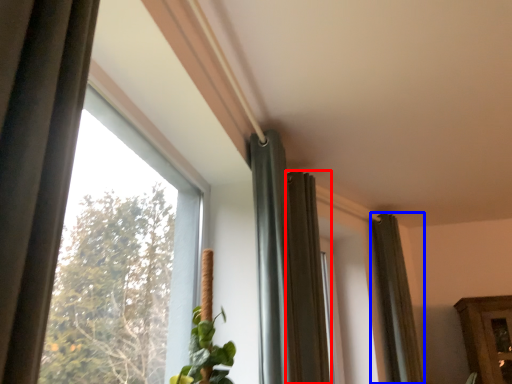
Question: Which point is further to the camera, curtain (highlighted by a red box) or curtain (highlighted by a blue box)?

Choices:
 (A) curtain
 (B) curtain

Answer: (B)